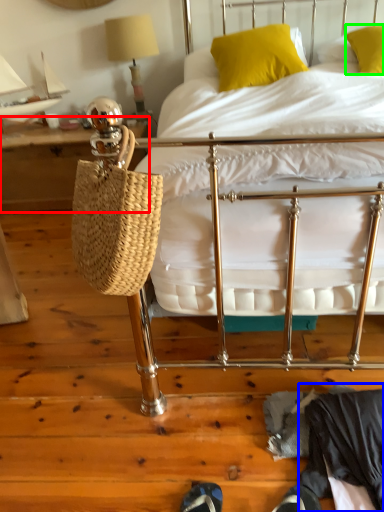
Question: Estimate the real-world distances between objects in this image. Which object is farther from table (highlighted by a red box), clothing (highlighted by a blue box) or pillow (highlighted by a green box)?

Choices:
 (A) clothing
 (B) pillow

Answer: (A)